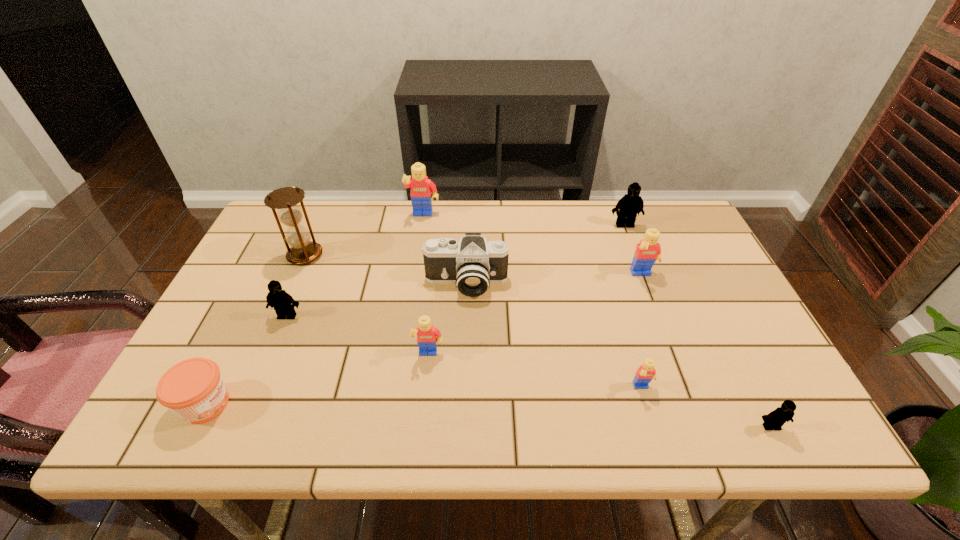
Identify the location of the second farthest black Lego. (283, 303).

Where is `the second nearest yellow Lego`? the second nearest yellow Lego is located at coordinates (428, 336).

Where is `the fourth nearest object`? the fourth nearest object is located at coordinates (428, 336).

This screenshot has height=540, width=960. What are the coordinates of `jam` in the screenshot? It's located at (193, 389).

Identify the location of the second nearest Lego. This screenshot has width=960, height=540. (645, 373).

Image resolution: width=960 pixels, height=540 pixels. What are the coordinates of `the nearest yellow Lego` in the screenshot? It's located at (645, 373).

Identify the location of the rightmost Lego. (776, 419).

Locate an element on the screen. The width and height of the screenshot is (960, 540). the smallest black Lego is located at coordinates (776, 419).

At what (x,y) coordinates should I click in order to perform the action: click on vacant space located 0.070m on the back of the eighth nearest object. Please return your answer as a coordinate pair (x, y). The image size is (960, 540). Looking at the image, I should click on (316, 229).

Locate an element on the screen. The image size is (960, 540). vacant area situated 0.350m on the face of the second tallest object is located at coordinates (410, 305).